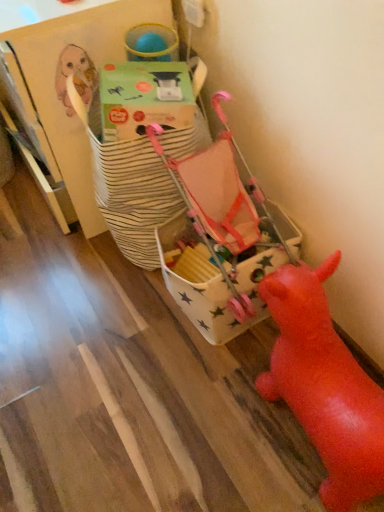
Question: From a real-world perspective, relative to white star-patterned fabric bag at center, the 1th toy from the back, is green cardboard box at upper center vertically above or below?

Choices:
 (A) below
 (B) above

Answer: (B)

Question: Visually, is green cardboard box at upper center positioned to the left or to the right of white star-patterned fabric bag at center, which is the second toy in front-to-back order?

Choices:
 (A) right
 (B) left

Answer: (B)

Question: Which is nearer to the rubber red pig at lower right, acting as the second toy starting from the back?

Choices:
 (A) green cardboard box at upper center
 (B) white star-patterned fabric bag at center, the 1th toy from the back

Answer: (B)

Question: Estimate the real-world distances between objects in this image. Which object is farther from the white star-patterned fabric bag at center, which is the second toy in front-to-back order?

Choices:
 (A) rubber red pig at lower right, acting as the second toy starting from the back
 (B) green cardboard box at upper center

Answer: (A)